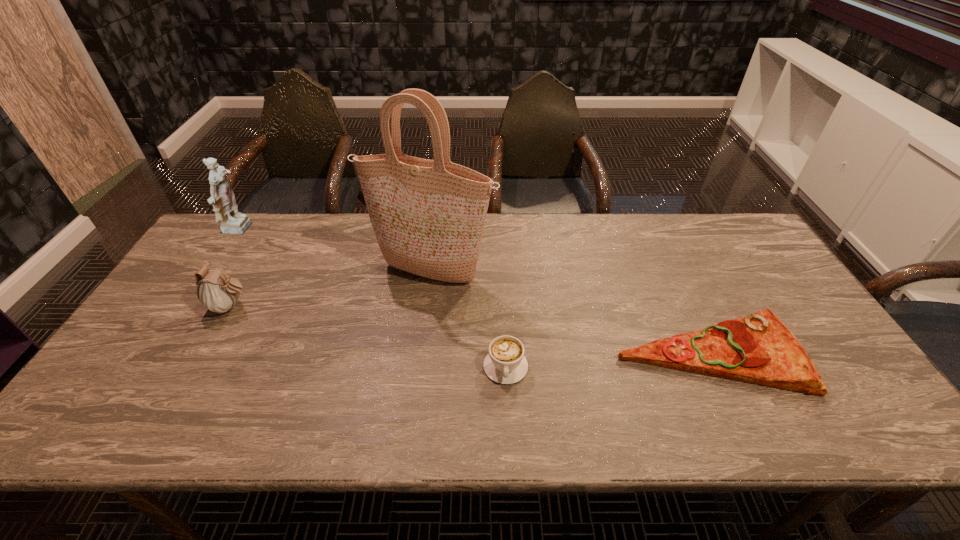
The width and height of the screenshot is (960, 540). What are the coordinates of `vacant space at the far edge of the desktop` in the screenshot? It's located at (578, 226).

Find the location of a particular element. Image resolution: width=960 pixels, height=540 pixels. vacant region at the near edge of the desktop is located at coordinates (795, 408).

Where is `free spot at the left edge of the desktop`? free spot at the left edge of the desktop is located at coordinates (157, 384).

This screenshot has height=540, width=960. Find the location of `free spot at the right edge of the desktop`. free spot at the right edge of the desktop is located at coordinates (720, 266).

The image size is (960, 540). What are the coordinates of `vacant space at the far left corner of the desktop` in the screenshot? It's located at (220, 244).

In the image, there is a desktop. Identify the location of vacant region at the near left corner. (77, 433).

I want to click on free location at the near right corner, so pyautogui.click(x=822, y=440).

This screenshot has width=960, height=540. I want to click on vacant point located between the shortest object and the fourth tallest object, so tap(607, 360).

Find the location of a particular element. This screenshot has width=960, height=540. vacant area that lies between the second tallest object and the shortest object is located at coordinates (473, 292).

The width and height of the screenshot is (960, 540). In order to click on free space between the cappuccino and the shortest object in this screenshot , I will do `click(607, 360)`.